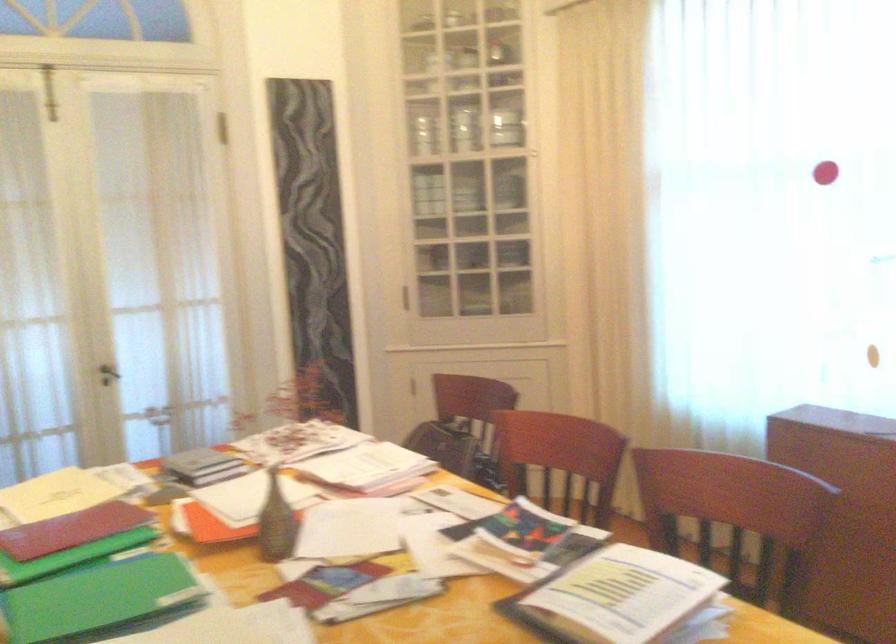
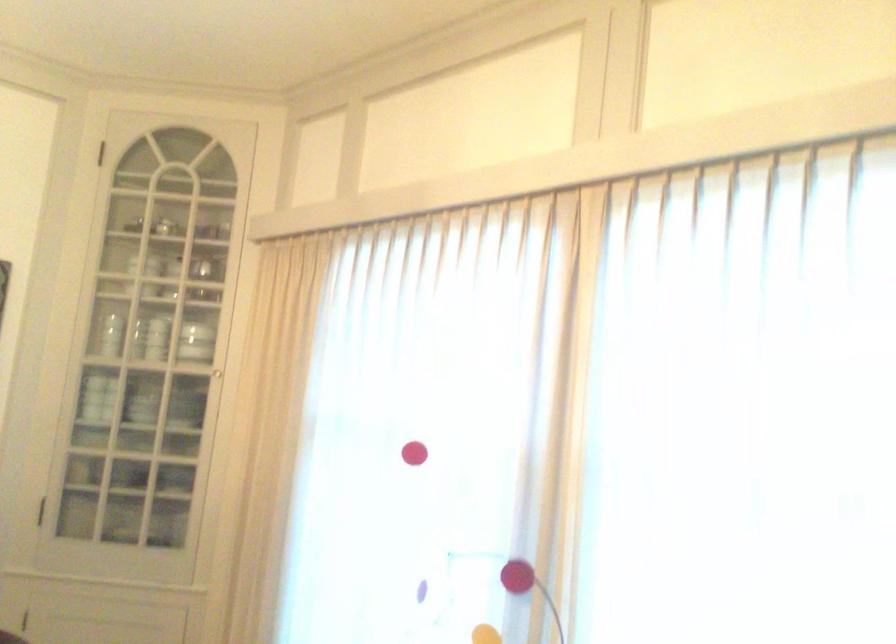
Question: Based on the continuous images, in which direction is the camera rotating? Reply with the corresponding letter.

Choices:
 (A) Left
 (B) Right
 (C) Up
 (D) Down

Answer: (C)